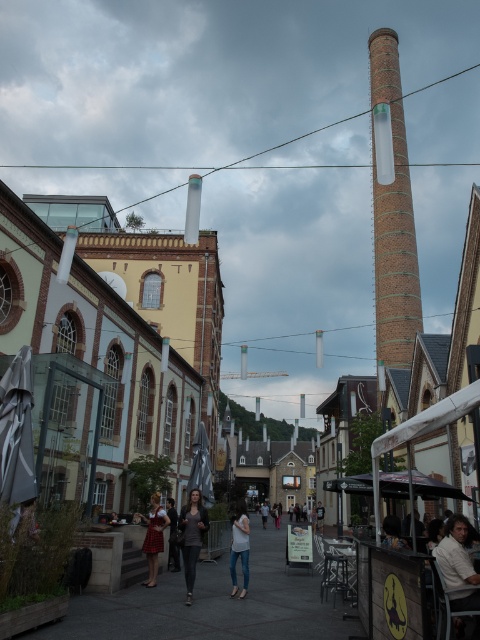
Is point (454, 596) positioned before point (231, 577)?

Yes.

Is the position of white matte shirt at lower right less distant than that of denim pants at center?

That is True.

Between point (447, 556) and point (241, 509), which one is positioned behind?

The point (241, 509) is more distant.

Where is `white matte shirt at lower right`? The height and width of the screenshot is (640, 480). white matte shirt at lower right is located at coordinates (456, 552).

Who is taller, red plaid skirt at center or matte black dress at center?

With more height is red plaid skirt at center.

Can you confirm if red plaid skirt at center is taller than matte black dress at center?

Correct, red plaid skirt at center is much taller as matte black dress at center.

Is point (154, 566) positioned in front of point (176, 570)?

Yes.

Identify the location of red plaid skirt at center. (154, 538).

Does dark gray fabric pants at center have a greater width compared to red plaid skirt at center?

Incorrect, dark gray fabric pants at center's width does not surpass red plaid skirt at center's.

Does point (190, 564) lie behind point (134, 513)?

That is False.

Identify the location of dark gray fabric pants at center. (192, 536).